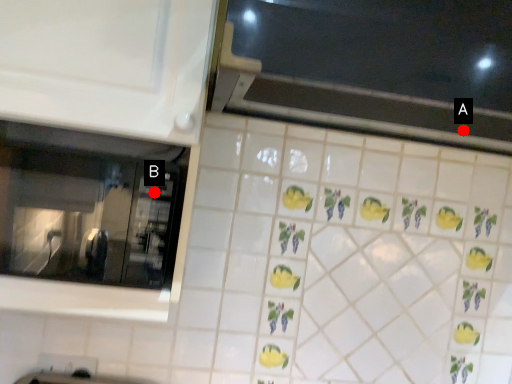
Question: Two points are circled on the image, labeled by A and B beside each circle. Among these points, which one is nearest to the camera?

Choices:
 (A) A is closer
 (B) B is closer

Answer: (B)